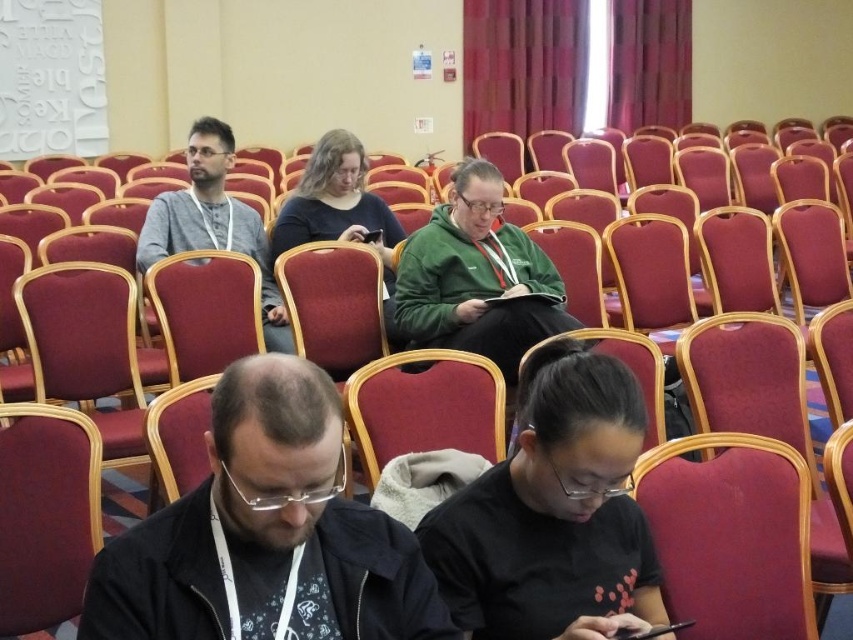
You are standing in the conference room and notice two attendees wearing the black matte jacket at lower center and the gray knit sweater at left. Which attendee is sitting closer to the front of the room?

The black matte jacket at lower center is positioned under the gray knit sweater at left, meaning it is closer to the front of the room.

You are standing in the conference room and notice two people wearing the black matte shirt at lower center and the gray knit sweater at left. Which person is sitting closer to the front of the room?

The black matte shirt at lower center is closer to the viewer than the gray knit sweater at left, so the person wearing the black matte shirt at lower center is sitting closer to the front of the room.

You are organizing a photo shoot in the conference room and need to ensure that all clothing items are visible in the frame. Given the black matte jacket at lower center and the gray knit sweater at left, which clothing item might require a closer zoom to be fully visible?

The black matte jacket at lower center is smaller than the gray knit sweater at left, so it might require a closer zoom to be fully visible.